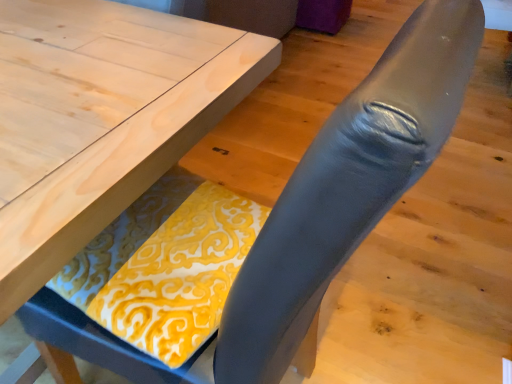
Question: Considering the positions of light wood table at center and yellow printed fabric at lower center in the image, is light wood table at center taller or shorter than yellow printed fabric at lower center?

Choices:
 (A) short
 (B) tall

Answer: (B)

Question: Would you say light wood table at center is to the left or to the right of yellow printed fabric at lower center in the picture?

Choices:
 (A) left
 (B) right

Answer: (A)

Question: Choose the correct answer: Is light wood table at center inside yellow printed fabric at lower center or outside it?

Choices:
 (A) outside
 (B) inside

Answer: (A)

Question: Considering the relative positions of yellow printed fabric at lower center and light wood table at center in the image provided, is yellow printed fabric at lower center to the left or to the right of light wood table at center?

Choices:
 (A) right
 (B) left

Answer: (A)

Question: Is yellow printed fabric at lower center in front of or behind light wood table at center in the image?

Choices:
 (A) front
 (B) behind

Answer: (B)

Question: Choose the correct answer: Is yellow printed fabric at lower center inside light wood table at center or outside it?

Choices:
 (A) inside
 (B) outside

Answer: (A)

Question: Is yellow printed fabric at lower center wider or thinner than light wood table at center?

Choices:
 (A) thin
 (B) wide

Answer: (A)